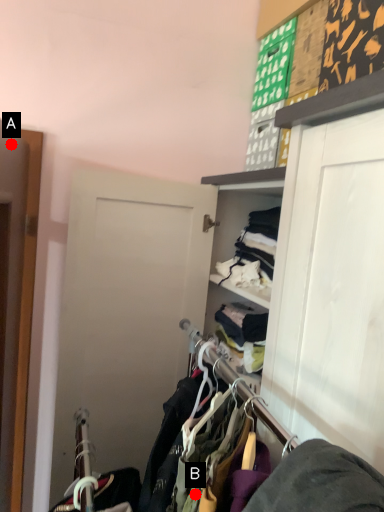
Question: Two points are circled on the image, labeled by A and B beside each circle. Which point is farther from the camera taking this photo?

Choices:
 (A) A is further
 (B) B is further

Answer: (A)